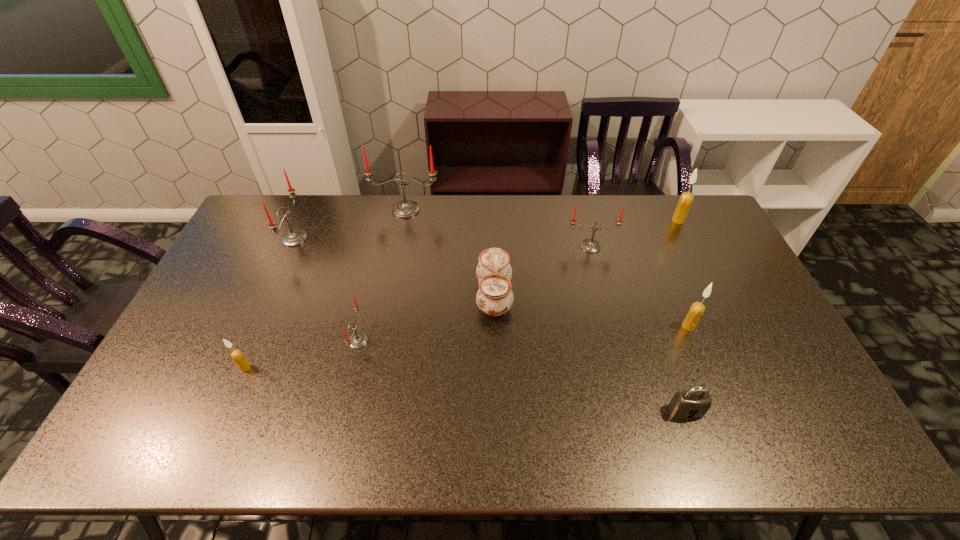
At what (x,y) coordinates should I click in order to perform the action: click on the biggest red candle. Please return your answer as a coordinate pair (x, y). Looking at the image, I should click on (406, 208).

Find the location of a particular element. This screenshot has width=960, height=540. the tallest candle is located at coordinates (406, 208).

This screenshot has height=540, width=960. Find the location of `the rightmost object`. the rightmost object is located at coordinates (686, 198).

The width and height of the screenshot is (960, 540). In order to click on the rightmost candle in this screenshot , I will do `click(686, 198)`.

Image resolution: width=960 pixels, height=540 pixels. Identify the location of the leftmost red candle. (295, 237).

The width and height of the screenshot is (960, 540). I want to click on the rightmost red candle, so click(x=588, y=245).

Where is `the fourth object from right to left`? Image resolution: width=960 pixels, height=540 pixels. the fourth object from right to left is located at coordinates point(588,245).

Locate an element on the screen. The width and height of the screenshot is (960, 540). the second object from right to left is located at coordinates (696, 310).

Where is `the second farthest cream candle`? The width and height of the screenshot is (960, 540). the second farthest cream candle is located at coordinates (696, 310).

Locate an element on the screen. Image resolution: width=960 pixels, height=540 pixels. the fifth object from left to right is located at coordinates (494, 297).